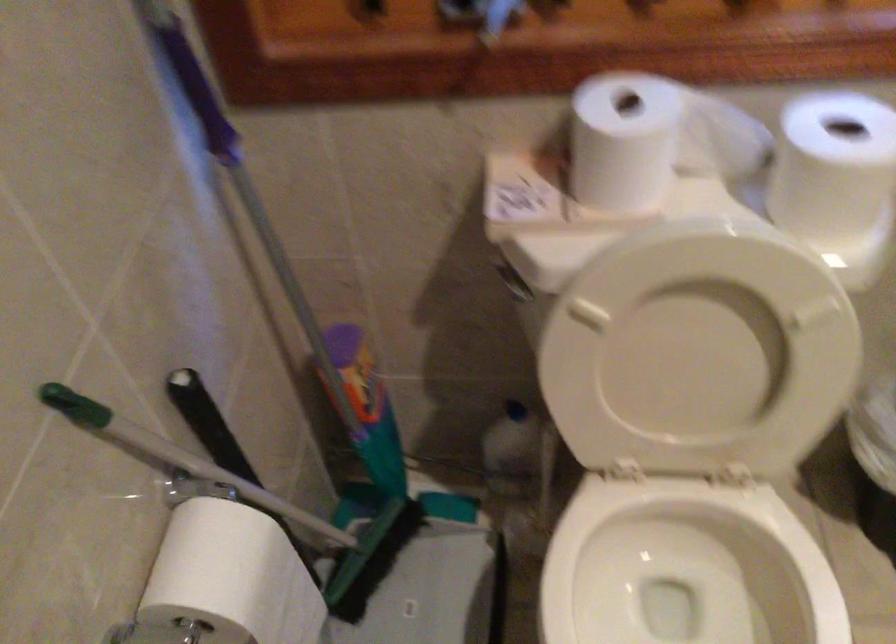
Find where to lift the white toilet seat. Please return your answer as a coordinate pair (x, y).

(702, 395)